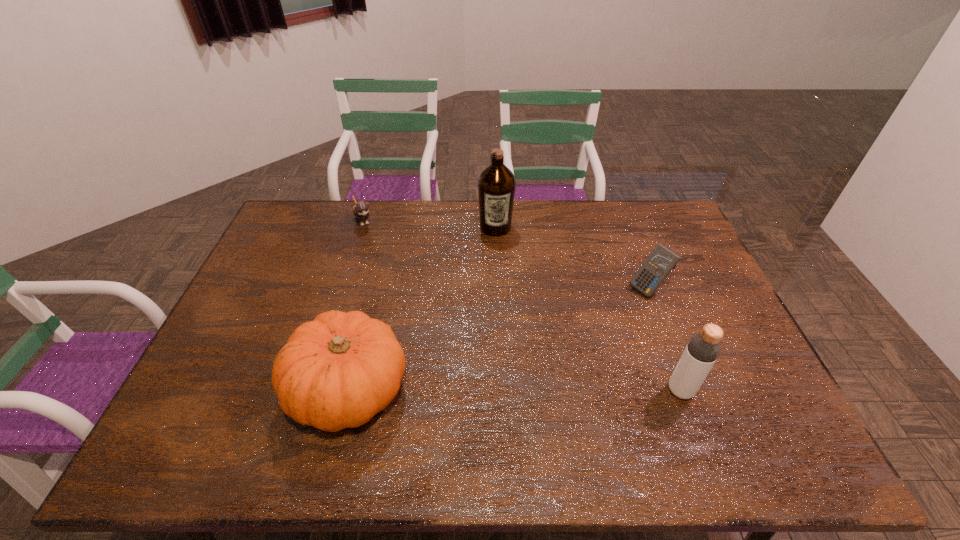
The width and height of the screenshot is (960, 540). What are the coordinates of `free space on the desktop that is between the third tallest object and the fourth shortest object and is positioned on the front-facing side of the second shortest object` in the screenshot? It's located at (516, 390).

Identify the location of vacant space on the desktop that is between the pumpkin and the bottle and is positioned on the label of the third object from right to left. (508, 390).

Where is `vacant spot on the desktop that is between the pumpkin and the second tallest object and is positioned on the front-facing side of the shortest object`? Image resolution: width=960 pixels, height=540 pixels. vacant spot on the desktop that is between the pumpkin and the second tallest object and is positioned on the front-facing side of the shortest object is located at coordinates (466, 390).